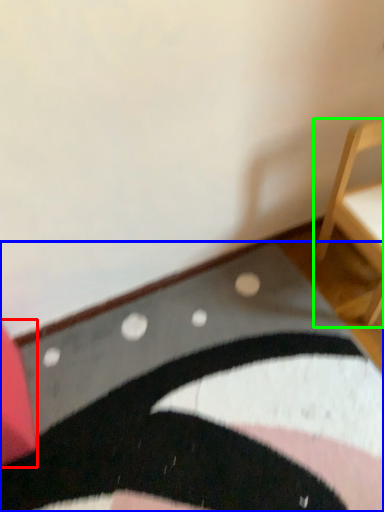
Question: Considering the real-world distances, which object is closest to furniture (highlighted by a red box)? mat (highlighted by a blue box) or furniture (highlighted by a green box).

Choices:
 (A) mat
 (B) furniture

Answer: (A)